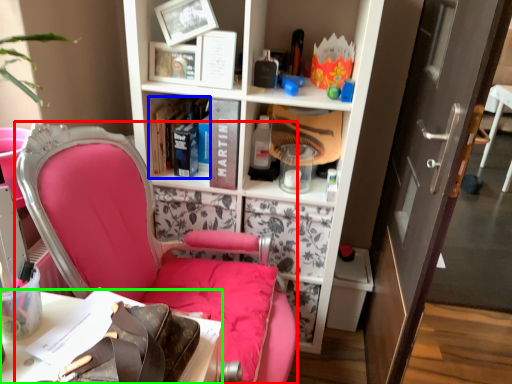
Question: Based on their relative distances, which object is nearer to chair (highlighted by a red box)? Choose from book (highlighted by a blue box) and desk (highlighted by a green box).

Choices:
 (A) book
 (B) desk

Answer: (B)